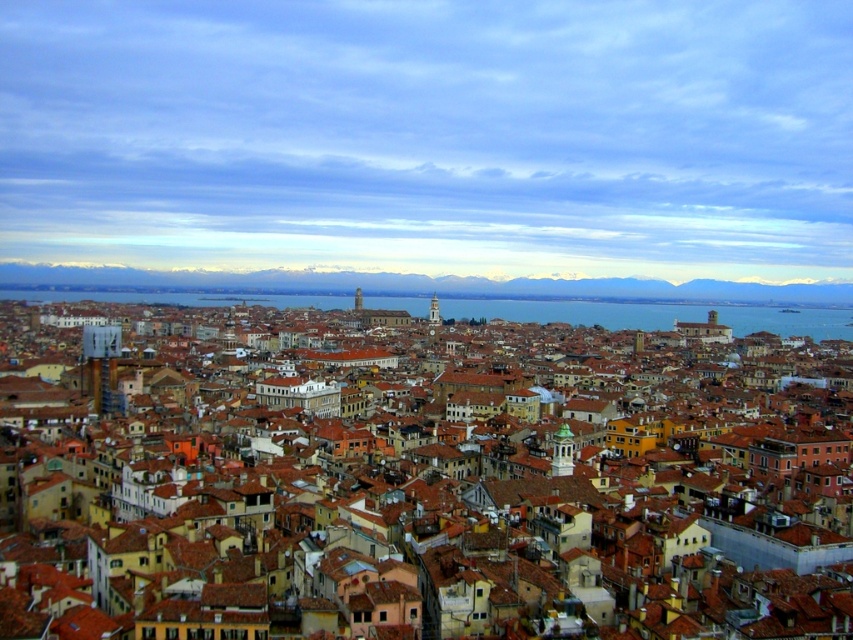
Question: Which object is closer to the camera taking this photo?

Choices:
 (A) blue water at center
 (B) brown tiled roofs at center

Answer: (B)

Question: Which point appears farthest from the camera in this image?

Choices:
 (A) (432, 580)
 (B) (792, 314)

Answer: (B)

Question: Can you confirm if brown tiled roofs at center is smaller than blue water at center?

Choices:
 (A) no
 (B) yes

Answer: (A)

Question: Can you confirm if brown tiled roofs at center is bigger than blue water at center?

Choices:
 (A) no
 (B) yes

Answer: (B)

Question: From the image, what is the correct spatial relationship of brown tiled roofs at center in relation to blue water at center?

Choices:
 (A) above
 (B) below

Answer: (B)